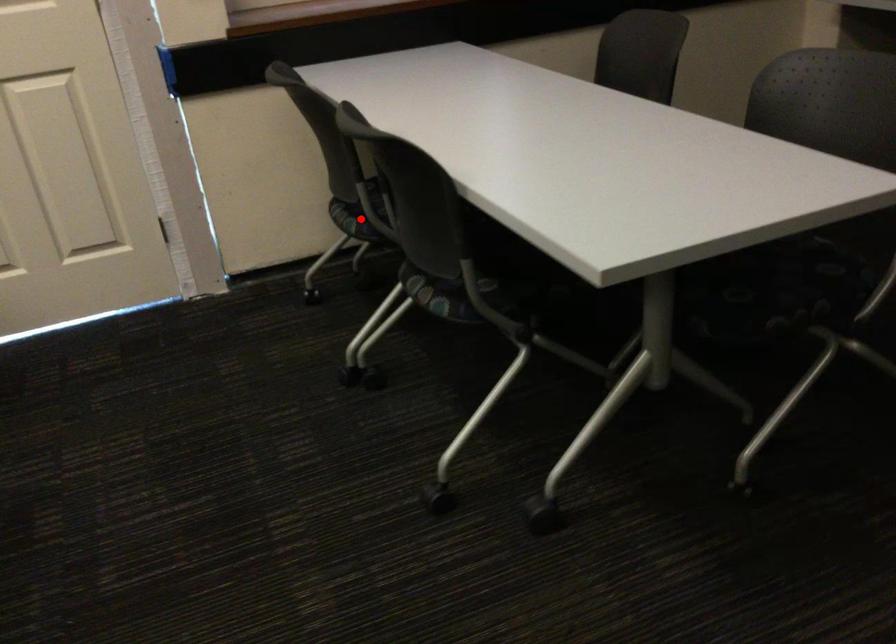
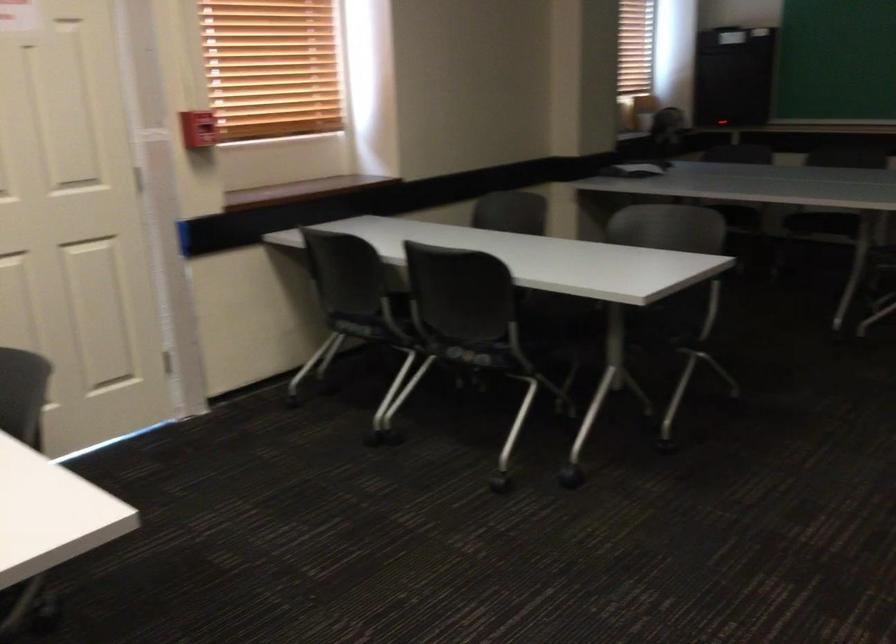
The point at the highlighted location is marked in the first image. Where is the corresponding point in the second image?

(360, 328)